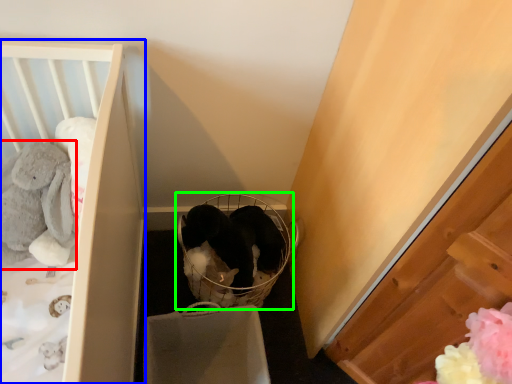
Question: Which is nearer to the animal (highlighted by a red box)? furniture (highlighted by a blue box) or baby carriage (highlighted by a green box).

Choices:
 (A) furniture
 (B) baby carriage

Answer: (A)